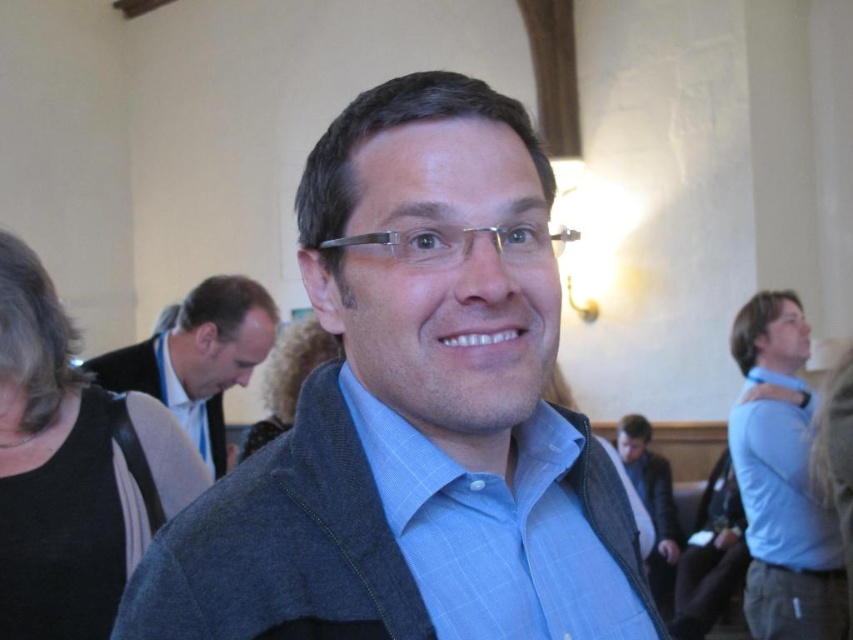
Question: Which point is farther to the camera?

Choices:
 (A) (486, 497)
 (B) (192, 529)

Answer: (A)

Question: Among these points, which one is farthest from the camera?

Choices:
 (A) (769, 588)
 (B) (161, 388)

Answer: (B)

Question: Does blue shirt at right appear on the right side of matte black jacket at center?

Choices:
 (A) yes
 (B) no

Answer: (A)

Question: Considering the relative positions of blue plaid shirt at center and matte black jacket at center in the image provided, where is blue plaid shirt at center located with respect to matte black jacket at center?

Choices:
 (A) above
 (B) below

Answer: (B)

Question: Can you confirm if blue textured shirt at center is wider than blue shirt at right?

Choices:
 (A) no
 (B) yes

Answer: (B)

Question: Which object is farther from the camera taking this photo?

Choices:
 (A) blue textured shirt at center
 (B) blue shirt at right

Answer: (B)